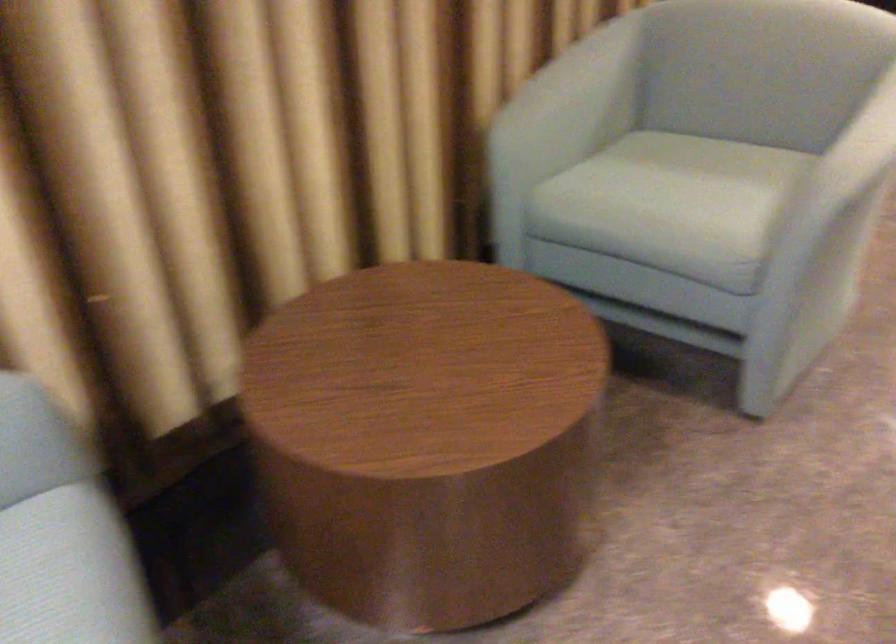
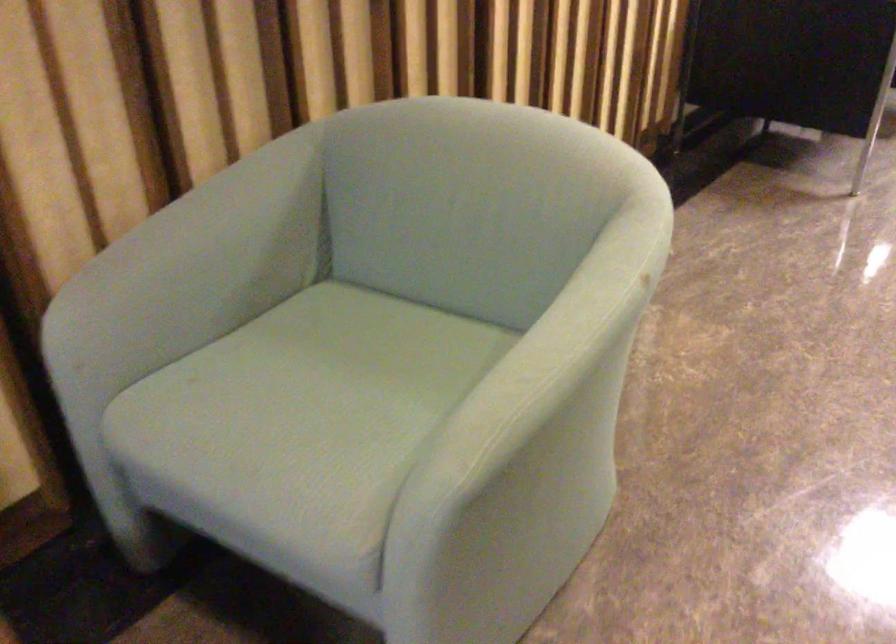
Question: How did the camera likely rotate?

Choices:
 (A) Left
 (B) Right
 (C) Up
 (D) Down

Answer: (B)